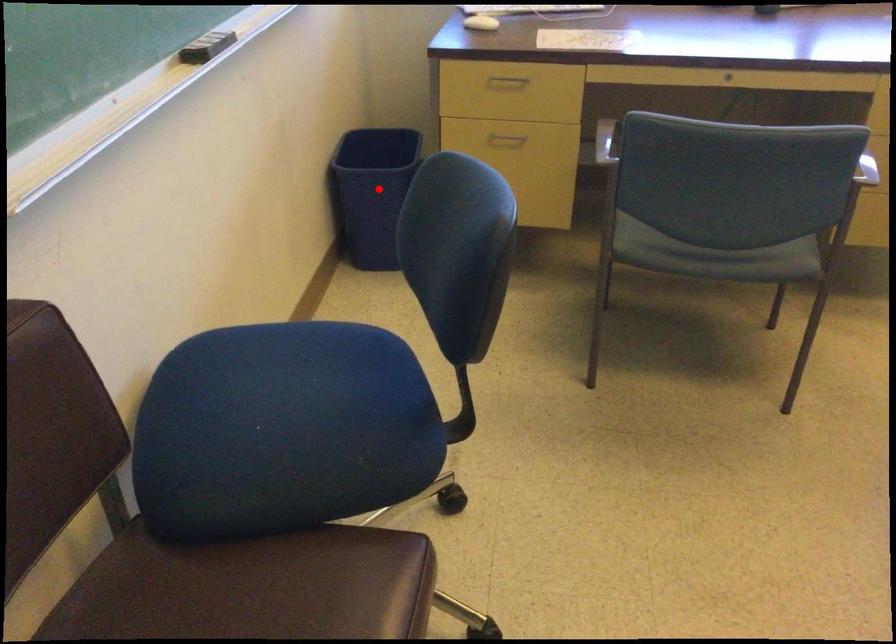
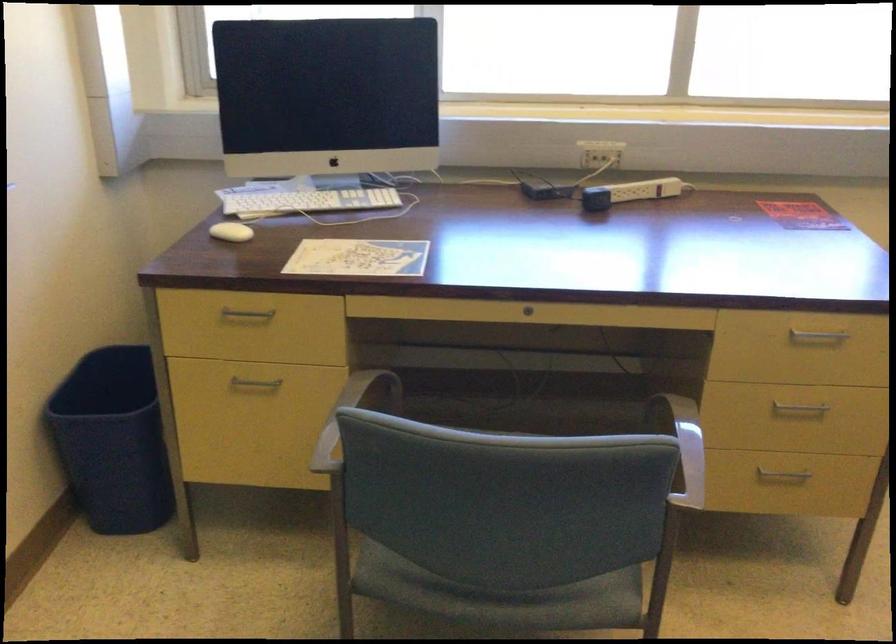
Question: A red point is marked in image1. In image2, is the corresponding 3D point closer to the camera or farther? Reply with the corresponding letter.

Choices:
 (A) The corresponding 3D point is closer.
 (B) The corresponding 3D point is farther.

Answer: (A)